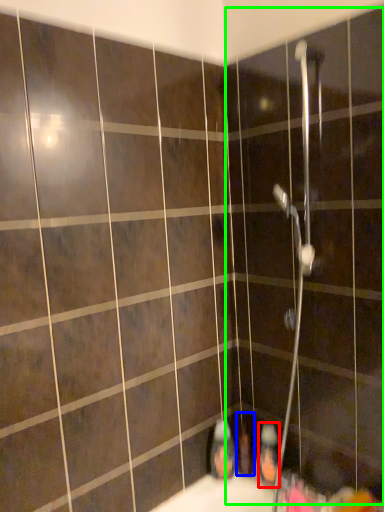
Question: Estimate the real-world distances between objects in this image. Which object is closer to toiletry (highlighted by a red box), toiletry (highlighted by a blue box) or screen door (highlighted by a green box)?

Choices:
 (A) toiletry
 (B) screen door

Answer: (A)